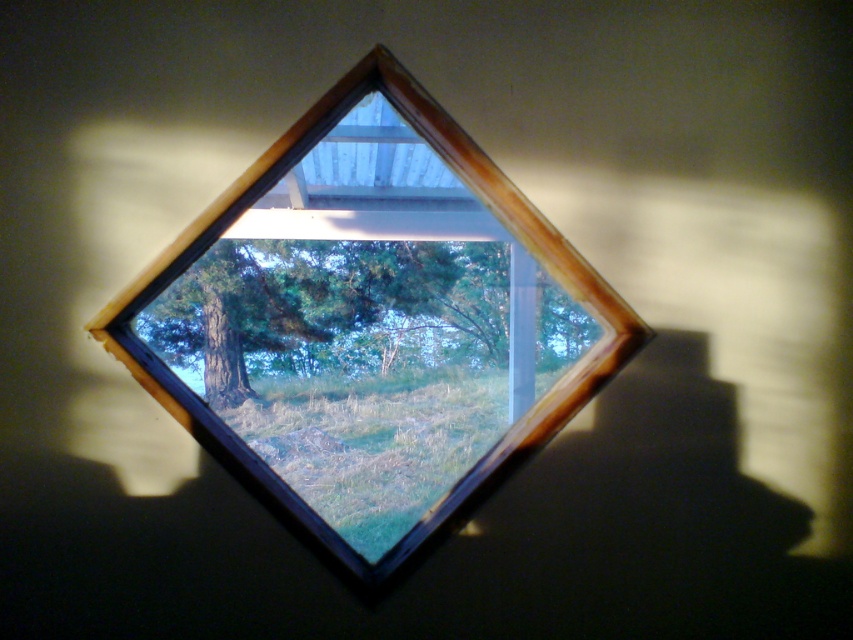
Describe the element at coordinates (370, 324) in the screenshot. I see `wooden window frame at center` at that location.

Is wooden window frame at center shorter than green matte tree at center?

Indeed, wooden window frame at center has a lesser height compared to green matte tree at center.

At what (x,y) coordinates should I click in order to perform the action: click on wooden window frame at center. Please return your answer as a coordinate pair (x, y). This screenshot has width=853, height=640. Looking at the image, I should click on (370, 324).